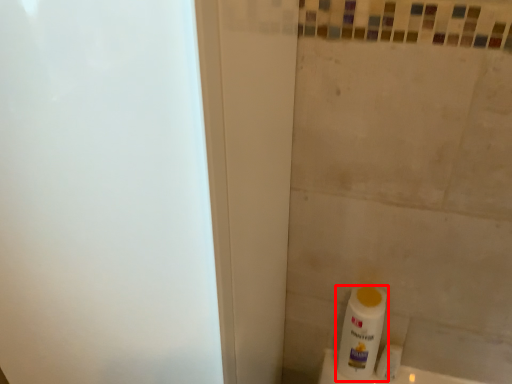
Question: From the image's perspective, considering the relative positions of bottle (annotated by the red box) and toilet paper in the image provided, where is bottle (annotated by the red box) located with respect to the staircase?

Choices:
 (A) below
 (B) above

Answer: (B)